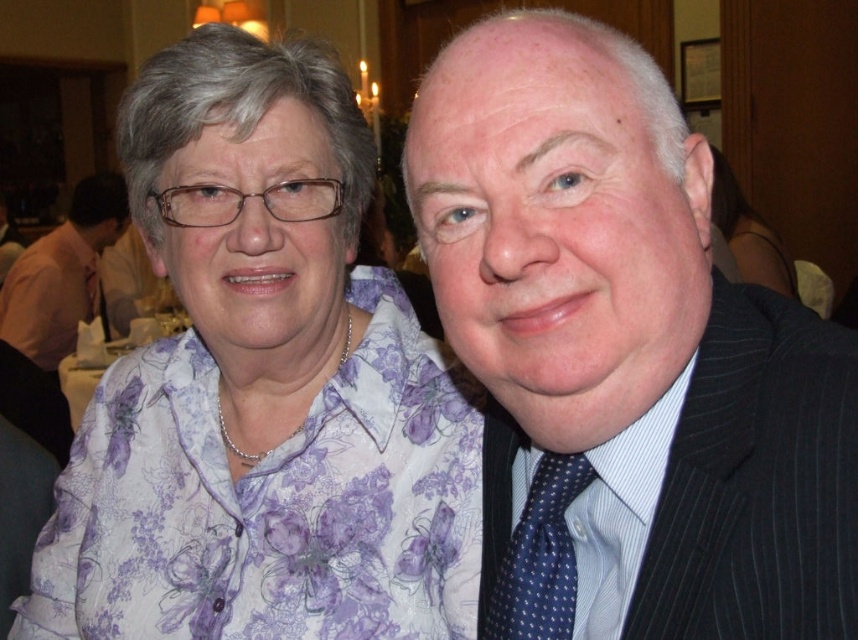
Does dark blue pinstripe suit at right have a greater height compared to blue dotted tie at right?

Correct, dark blue pinstripe suit at right is much taller as blue dotted tie at right.

From the picture: Between dark blue pinstripe suit at right and blue dotted tie at right, which one appears on the right side from the viewer's perspective?

dark blue pinstripe suit at right

What do you see at coordinates (758, 483) in the screenshot? The image size is (858, 640). I see `dark blue pinstripe suit at right` at bounding box center [758, 483].

Find the location of a particular element. Image resolution: width=858 pixels, height=640 pixels. dark blue pinstripe suit at right is located at coordinates (758, 483).

Does dark blue pinstripe suit at right appear under purple floral blouse at upper left?

Yes.

Who is positioned more to the right, dark blue pinstripe suit at right or purple floral blouse at upper left?

purple floral blouse at upper left is more to the right.

This screenshot has height=640, width=858. Describe the element at coordinates (758, 483) in the screenshot. I see `dark blue pinstripe suit at right` at that location.

Locate an element on the screen. dark blue pinstripe suit at right is located at coordinates (758, 483).

The width and height of the screenshot is (858, 640). What do you see at coordinates (263, 388) in the screenshot?
I see `purple floral shirt at left` at bounding box center [263, 388].

Does point (144, 218) come farther from viewer compared to point (61, 250)?

No, it is not.

The image size is (858, 640). What do you see at coordinates (263, 388) in the screenshot? I see `purple floral shirt at left` at bounding box center [263, 388].

The height and width of the screenshot is (640, 858). What are the coordinates of `purple floral shirt at left` in the screenshot? It's located at (263, 388).